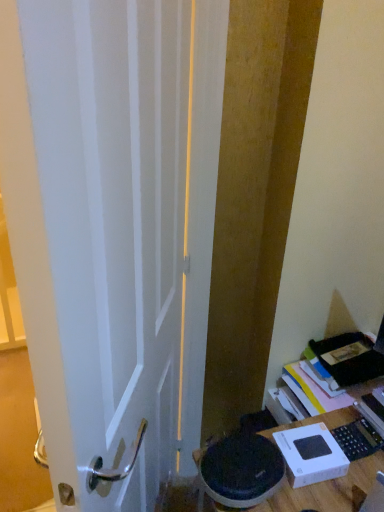
Question: Considering the positions of white glossy door at center and white cardboard box at lower right in the image, is white glossy door at center taller or shorter than white cardboard box at lower right?

Choices:
 (A) tall
 (B) short

Answer: (A)

Question: Considering their positions, is white glossy door at center located in front of or behind white cardboard box at lower right?

Choices:
 (A) front
 (B) behind

Answer: (A)

Question: From the image's perspective, is white glossy door at center located above or below white cardboard box at lower right?

Choices:
 (A) above
 (B) below

Answer: (A)

Question: In terms of size, does white cardboard box at lower right appear bigger or smaller than white glossy door at center?

Choices:
 (A) small
 (B) big

Answer: (A)

Question: Is white cardboard box at lower right wider or thinner than white glossy door at center?

Choices:
 (A) wide
 (B) thin

Answer: (A)

Question: Does point (331, 458) appear closer or farther from the camera than point (117, 240)?

Choices:
 (A) closer
 (B) farther

Answer: (B)

Question: Would you say white cardboard box at lower right is inside or outside white glossy door at center?

Choices:
 (A) inside
 (B) outside

Answer: (B)